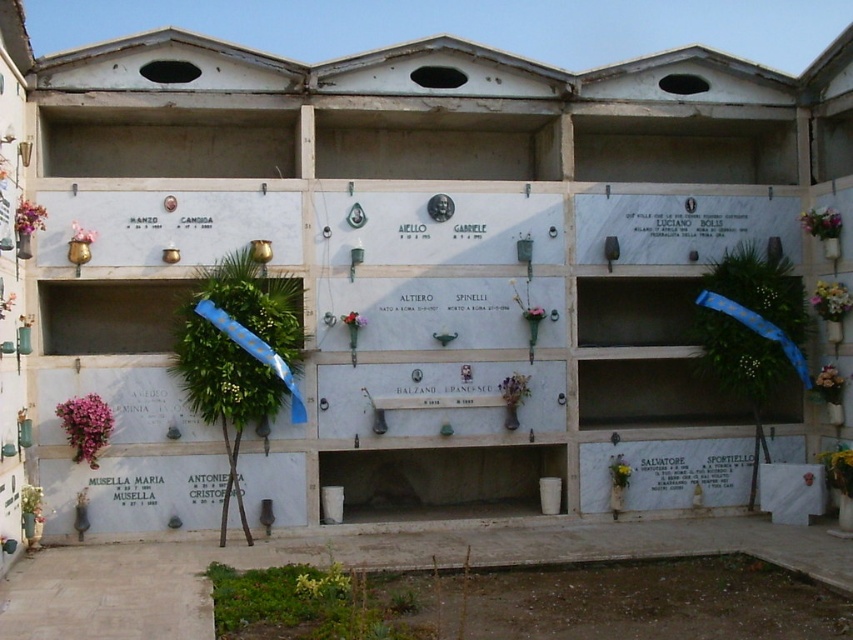
Question: Among these objects, which one is farthest from the camera?

Choices:
 (A) pink fabric flower at upper left
 (B) pink fabric flower at upper right
 (C) pink fabric flower at center left
 (D) green leafy plant at lower center

Answer: (B)

Question: Which point is closer to the camera?

Choices:
 (A) white fabric flower at right
 (B) green leafy wreath at center

Answer: (B)

Question: Is green leafy wreath at center wider than green leafy plant at lower right?

Choices:
 (A) no
 (B) yes

Answer: (B)

Question: Which object is the farthest from the pink fabric flower at upper left?

Choices:
 (A) pink fabric flower at upper right
 (B) green leafy plant at lower right
 (C) pink fabric flower at center right
 (D) green leafy wreath at right

Answer: (C)

Question: Considering the relative positions of pink fabric flower at upper right and pink fabric flower at center in the image provided, where is pink fabric flower at upper right located with respect to pink fabric flower at center?

Choices:
 (A) right
 (B) left

Answer: (A)

Question: Does green leafy wreath at right have a greater width compared to pink fabric flower at center right?

Choices:
 (A) no
 (B) yes

Answer: (B)